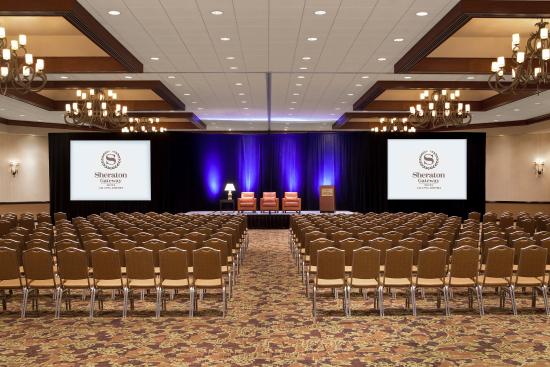
The height and width of the screenshot is (367, 550). I want to click on chair, so click(121, 271).